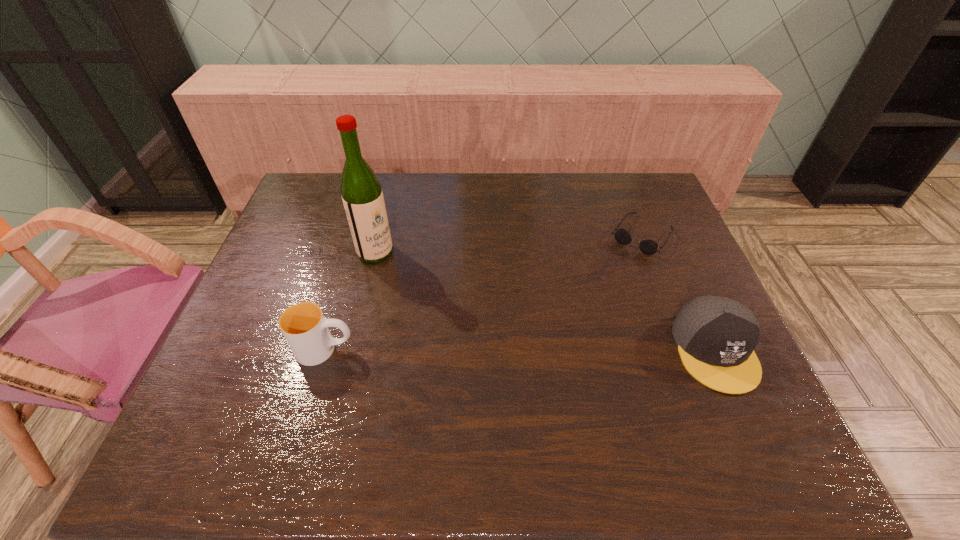
Identify the location of free space located on the front-facing side of the sunglasses. (622, 265).

Identify the location of object positioned at the far edge. The width and height of the screenshot is (960, 540). (649, 247).

Where is `object positioned at the near edge`? The width and height of the screenshot is (960, 540). object positioned at the near edge is located at coordinates (716, 336).

At what (x,y) coordinates should I click in order to perform the action: click on cap situated at the right edge. Please return your answer as a coordinate pair (x, y). Looking at the image, I should click on (716, 336).

Locate an element on the screen. The height and width of the screenshot is (540, 960). sunglasses located in the right edge section of the desktop is located at coordinates (649, 247).

This screenshot has height=540, width=960. In order to click on object that is at the far right corner in this screenshot , I will do `click(649, 247)`.

At what (x,y) coordinates should I click in order to perform the action: click on object present at the near right corner. Please return your answer as a coordinate pair (x, y). This screenshot has height=540, width=960. Looking at the image, I should click on pyautogui.click(x=716, y=336).

I want to click on vacant space at the far edge of the desktop, so click(x=579, y=189).

Locate an element on the screen. free point at the near edge is located at coordinates (642, 399).

Where is `free space at the left edge of the desktop`? This screenshot has width=960, height=540. free space at the left edge of the desktop is located at coordinates (321, 253).